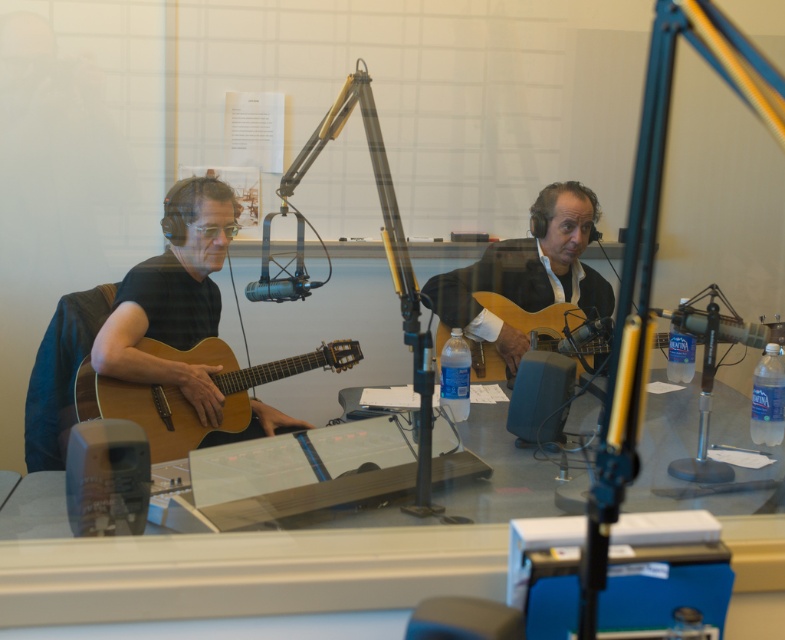
Is clear glass table at center taller than matte black guitar at left?

No.

Does point (225, 570) come in front of point (181, 387)?

Yes, point (225, 570) is closer to viewer.

I want to click on clear glass table at center, so click(x=243, y=573).

Does light brown acoustic guitar at center come in front of metallic silver microphone at center?

That is False.

Between light brown acoustic guitar at center and metallic silver microphone at center, which one is positioned higher?

Positioned higher is light brown acoustic guitar at center.

Find the location of a particular element. light brown acoustic guitar at center is located at coordinates (528, 269).

Is light wood acoustic guitar at center closer to camera compared to matte black microphone at center?

No, light wood acoustic guitar at center is behind matte black microphone at center.

Which is below, light wood acoustic guitar at center or matte black microphone at center?

light wood acoustic guitar at center is lower down.

Which is in front, point (543, 321) or point (314, 282)?

Point (314, 282) is in front.

Where is `light wood acoustic guitar at center`? The width and height of the screenshot is (785, 640). light wood acoustic guitar at center is located at coordinates (535, 317).